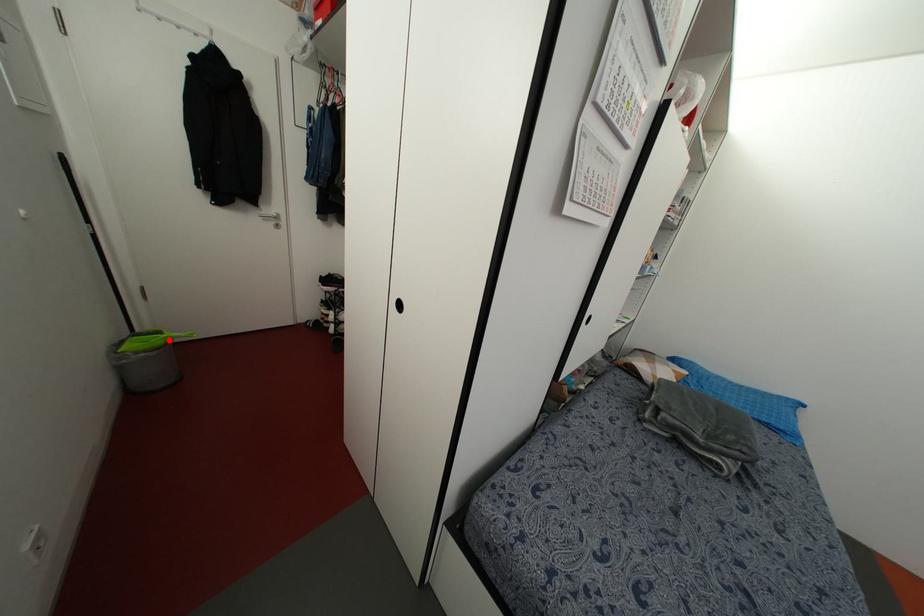
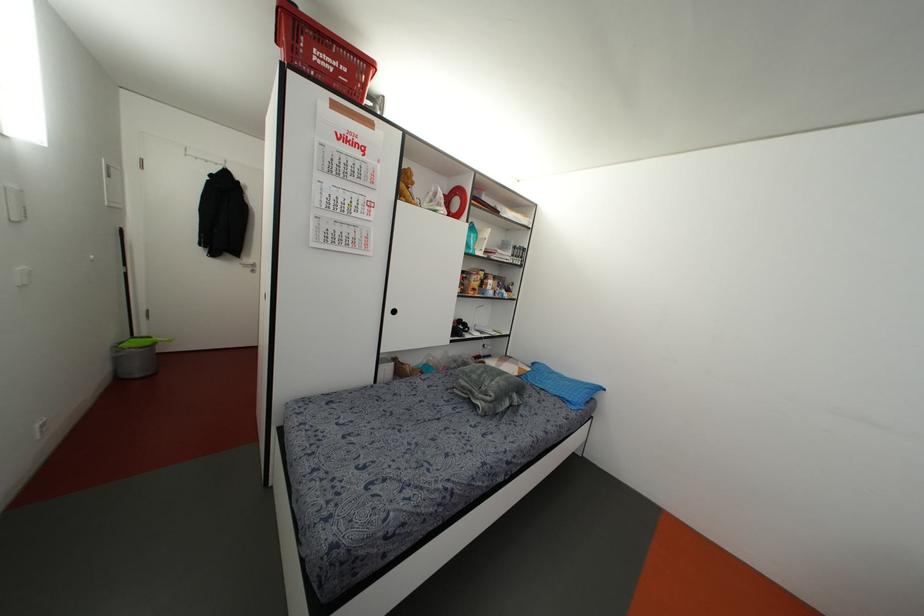
Locate, in the second image, the point that corresponds to the highlighted location in the first image.

(153, 342)